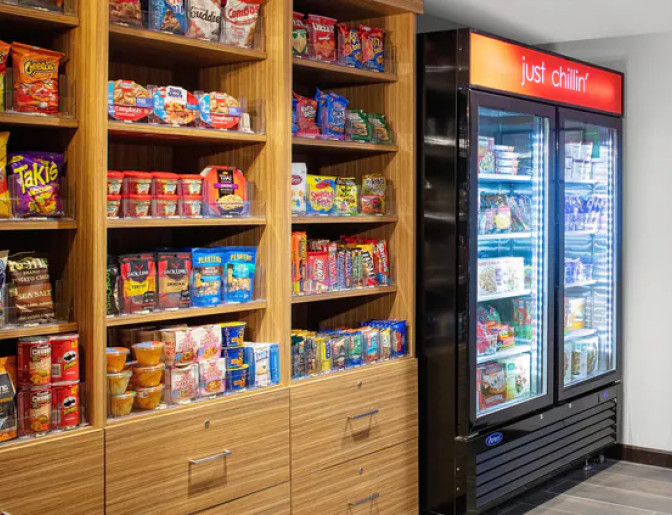
This screenshot has width=672, height=515. What are the coordinates of `pressed particle-board wood grain colored snack shelves and locked drawers at bottom` in the screenshot? It's located at (310, 409).